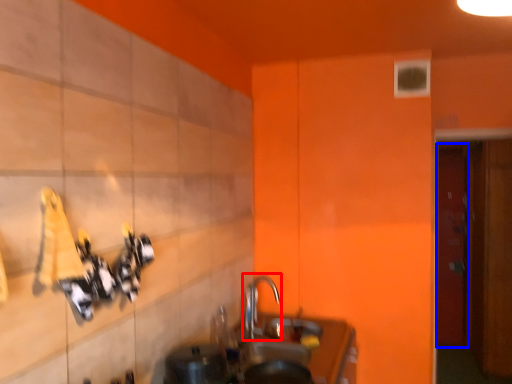
Question: Which object is further to the camera taking this photo, tap (highlighted by a red box) or door (highlighted by a blue box)?

Choices:
 (A) tap
 (B) door

Answer: (B)